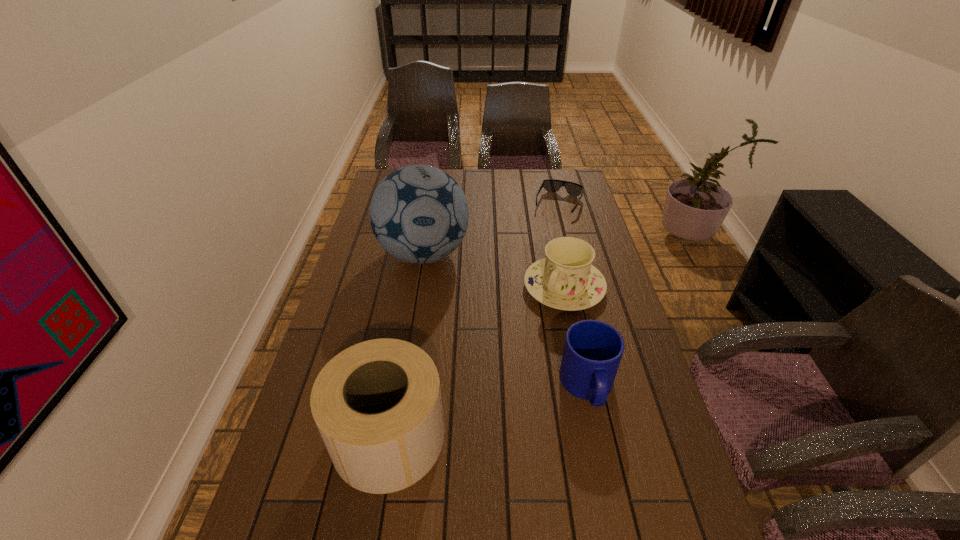
Locate an element on the screen. vacant area situated 0.310m on the front-facing side of the sunglasses is located at coordinates (534, 265).

Where is `vacant space located 0.290m on the handle side of the chinaware`? The width and height of the screenshot is (960, 540). vacant space located 0.290m on the handle side of the chinaware is located at coordinates (496, 377).

In order to click on free point located on the handle side of the chinaware in this screenshot , I will do `click(520, 345)`.

Where is `vacant space located 0.100m on the handle side of the chinaware`? The width and height of the screenshot is (960, 540). vacant space located 0.100m on the handle side of the chinaware is located at coordinates (530, 332).

This screenshot has height=540, width=960. Find the location of `free spot located on the side with brand of the soccer ball`. free spot located on the side with brand of the soccer ball is located at coordinates (486, 352).

This screenshot has width=960, height=540. Find the location of `vacant space located on the side with brand of the soccer ball`. vacant space located on the side with brand of the soccer ball is located at coordinates (486, 352).

Where is `free location located on the side with brand of the soccer ball`? The image size is (960, 540). free location located on the side with brand of the soccer ball is located at coordinates (459, 310).

You are a GUI agent. You are given a task and a screenshot of the screen. Output one action in this format:
    pyautogui.click(x=<x>, y=<y>)
    Task: Click on the object present at the far edge
    Image resolution: width=960 pixels, height=540 pixels.
    Given the screenshot: What is the action you would take?
    pyautogui.click(x=551, y=185)

This screenshot has width=960, height=540. I want to click on toilet tissue present at the left edge, so click(x=377, y=404).

Where is `soccer ball located in the left edge section of the desktop`? soccer ball located in the left edge section of the desktop is located at coordinates (419, 214).